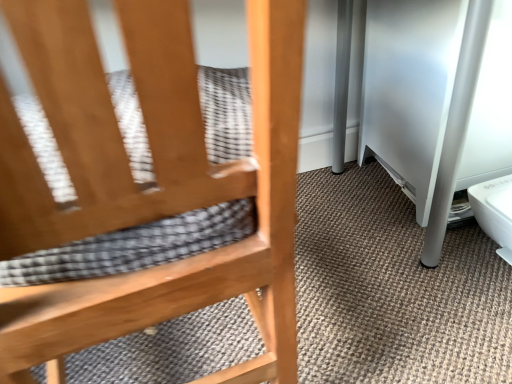
The width and height of the screenshot is (512, 384). I want to click on wooden chair at left, so click(149, 189).

The image size is (512, 384). What do you see at coordinates (149, 189) in the screenshot?
I see `wooden chair at left` at bounding box center [149, 189].

At what (x,y) coordinates should I click in order to perform the action: click on wooden chair at left. Please return your answer as a coordinate pair (x, y). The width and height of the screenshot is (512, 384). Looking at the image, I should click on (149, 189).